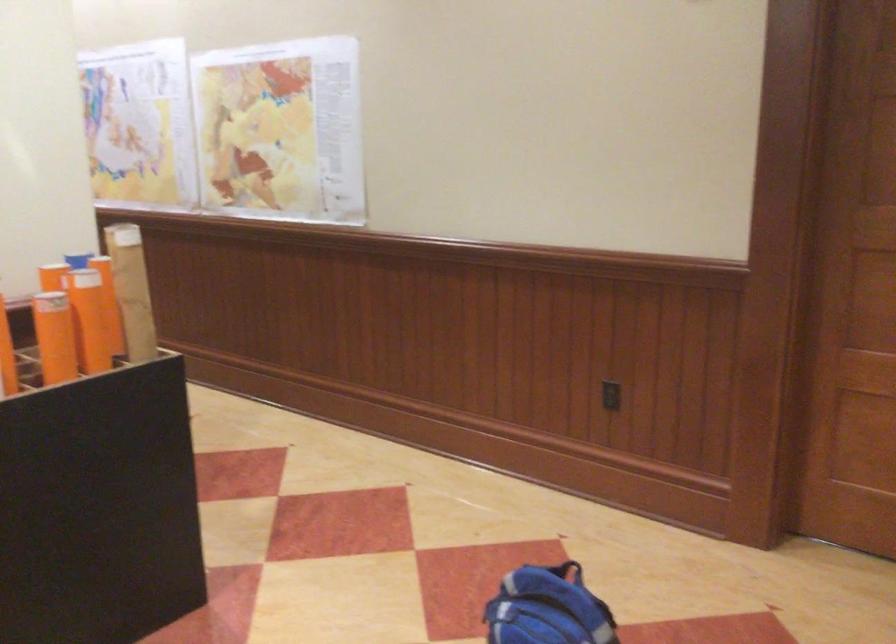
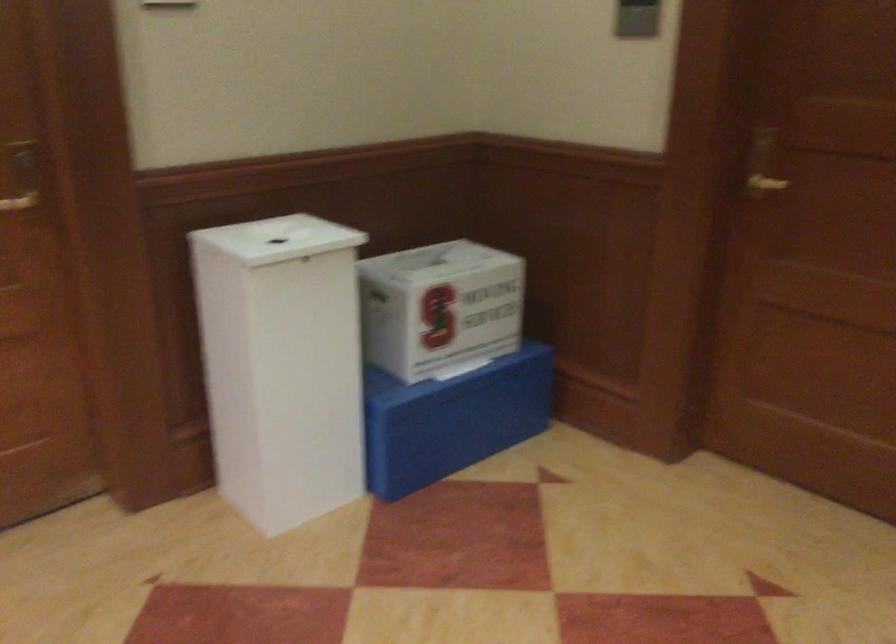
Question: The images are taken continuously from a first-person perspective. In which direction is your viewpoint rotating?

Choices:
 (A) Left
 (B) Right
 (C) Up
 (D) Down

Answer: (B)